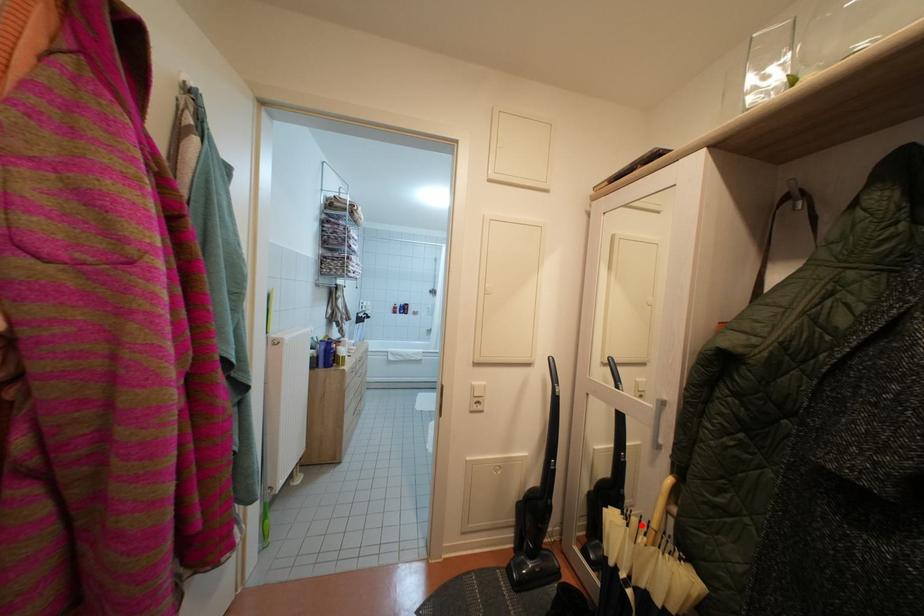
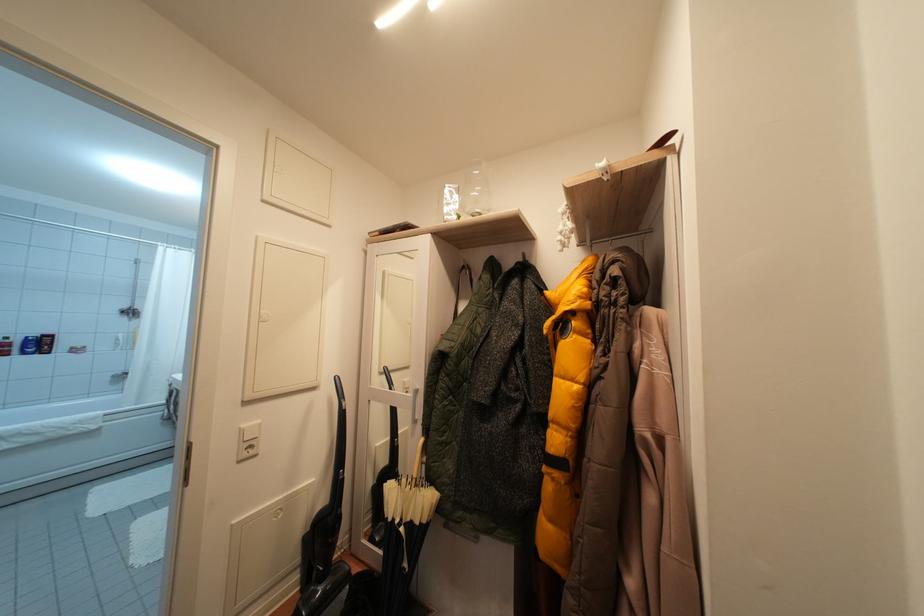
Question: I am providing you with two images of the same scene from different viewpoints. A red point is marked on the first image. Can you still see the location of the red point in image 2?

Choices:
 (A) Yes
 (B) No

Answer: (A)